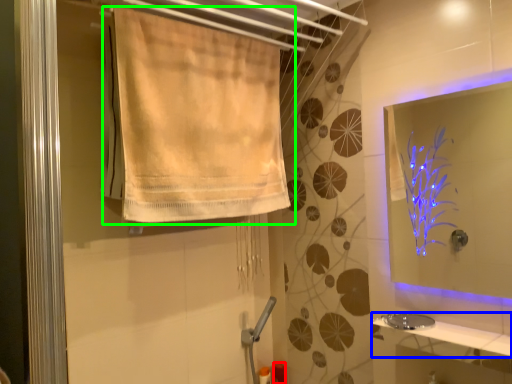
Question: Which object is positioned closest to toiletry (highlighted by a red box)? Select from counter top (highlighted by a blue box) and curtain (highlighted by a green box).

Choices:
 (A) counter top
 (B) curtain

Answer: (A)